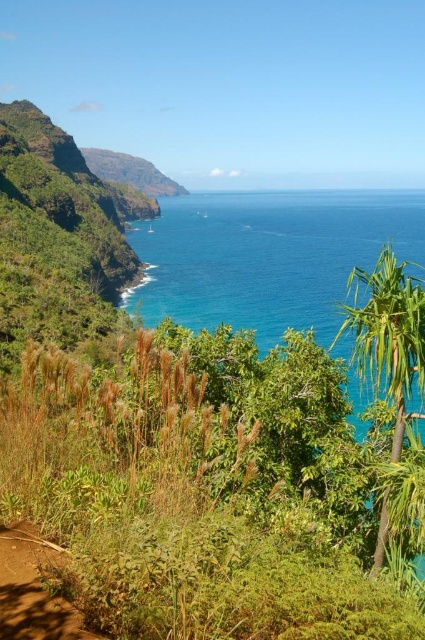
Which is behind, point (277, 474) or point (357, 404)?

The point (357, 404) is behind.

Who is positioned more to the right, green grassy shrubs at lower left or blue glossy water at center?

blue glossy water at center is more to the right.

Who is more distant from viewer, (277, 429) or (354, 248)?

The point (354, 248) is more distant.

Image resolution: width=425 pixels, height=640 pixels. I want to click on green grassy shrubs at lower left, so click(x=193, y=499).